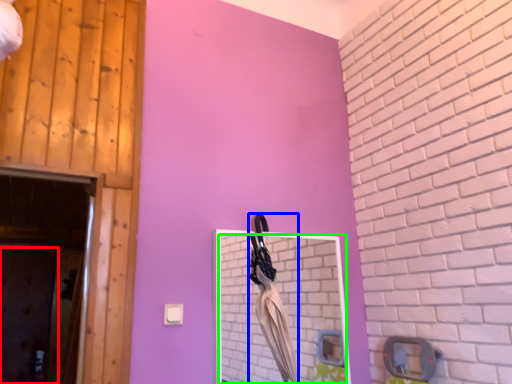
Question: Which object is the closest to the door (highlighted by a red box)? Choose among these: laundry (highlighted by a blue box) or mirror (highlighted by a green box).

Choices:
 (A) laundry
 (B) mirror

Answer: (B)